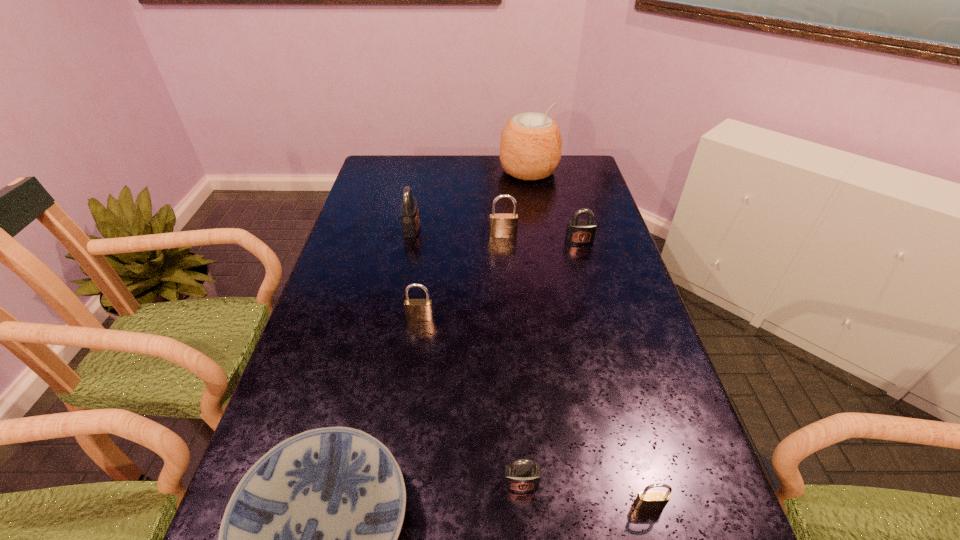
I want to click on brass padlock object that ranks as the closest to the plate, so (415, 309).